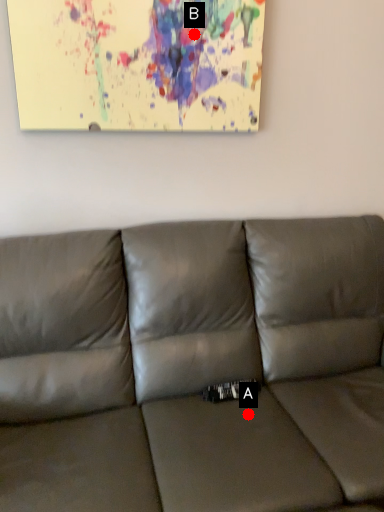
Question: Two points are circled on the image, labeled by A and B beside each circle. Among these points, which one is farthest from the camera?

Choices:
 (A) A is further
 (B) B is further

Answer: (B)